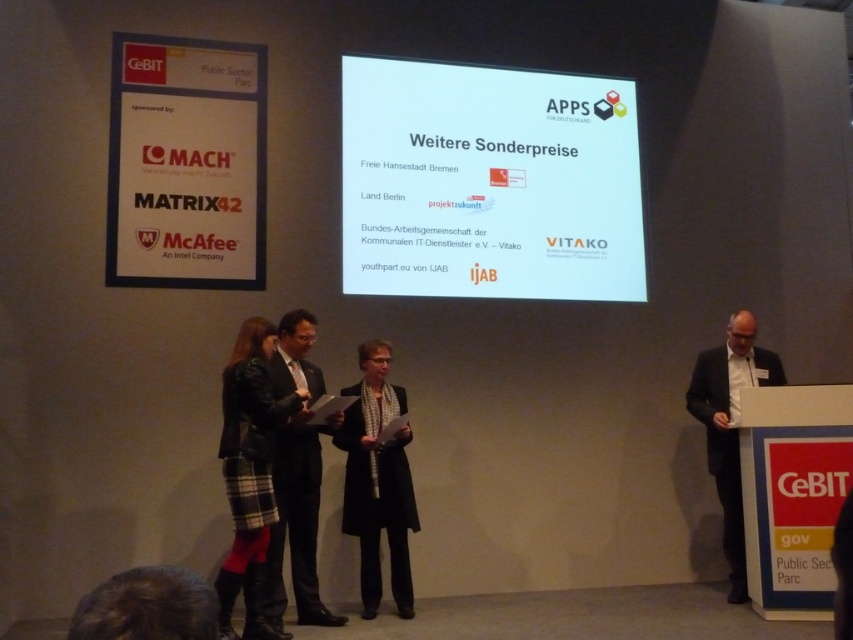
Question: From the image, what is the correct spatial relationship of black wool coat at center in relation to dark suit at right?

Choices:
 (A) right
 (B) left

Answer: (B)

Question: Which object is the farthest from the black wool coat at center?

Choices:
 (A) white glossy projection screen at center
 (B) dark suit at right

Answer: (B)

Question: Estimate the real-world distances between objects in this image. Which object is closer to the dark suit at right?

Choices:
 (A) plaid fabric skirt at center
 (B) black wool coat at center
 (C) white glossy projection screen at center

Answer: (C)

Question: Is plaid fabric skirt at center bigger than dark suit at right?

Choices:
 (A) no
 (B) yes

Answer: (A)

Question: Can you confirm if white glossy projection screen at center is positioned to the left of black wool coat at center?

Choices:
 (A) yes
 (B) no

Answer: (B)

Question: Which of the following is the closest to the observer?

Choices:
 (A) white glossy projection screen at center
 (B) dark suit at center
 (C) black wool coat at center
 (D) plaid fabric skirt at center

Answer: (D)